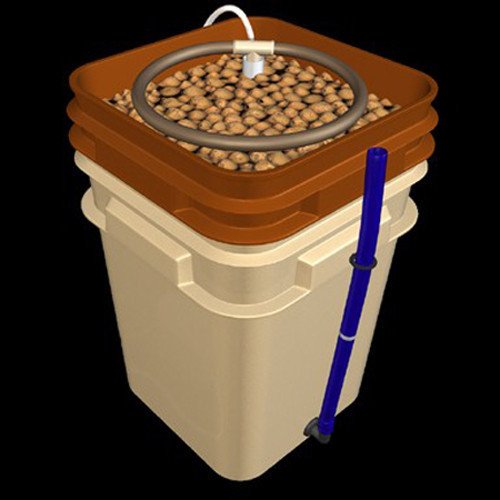
The width and height of the screenshot is (500, 500). What are the coordinates of `bucket` in the screenshot? It's located at [x=234, y=321], [x=191, y=181].